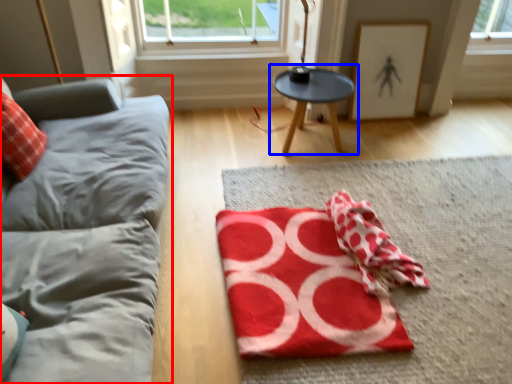
Question: Which of the following is the closest to the observer, studio couch (highlighted by a red box) or table (highlighted by a blue box)?

Choices:
 (A) studio couch
 (B) table

Answer: (A)